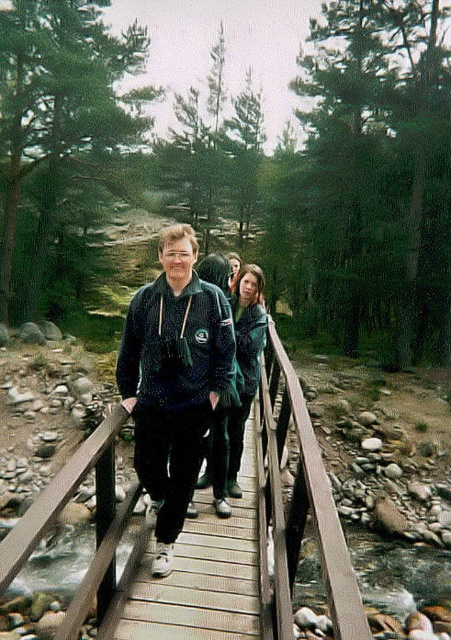
Question: Considering the real-world distances, which object is farthest from the wooden at center?

Choices:
 (A) dark blue hoodie at center
 (B) dark blue fleece at center

Answer: (B)

Question: Considering the relative positions of wooden at center and dark blue hoodie at center in the image provided, where is wooden at center located with respect to dark blue hoodie at center?

Choices:
 (A) above
 (B) below

Answer: (B)

Question: Estimate the real-world distances between objects in this image. Which object is farther from the dark blue hoodie at center?

Choices:
 (A) wooden at center
 (B) dark blue fleece at center

Answer: (B)

Question: Which of the following is the closest to the observer?

Choices:
 (A) dark blue fleece at center
 (B) dark blue hoodie at center
 (C) wooden at center

Answer: (A)

Question: Can you confirm if dark blue fleece at center is smaller than dark blue hoodie at center?

Choices:
 (A) no
 (B) yes

Answer: (B)

Question: From the image, what is the correct spatial relationship of wooden at center in relation to dark blue hoodie at center?

Choices:
 (A) above
 (B) below

Answer: (B)